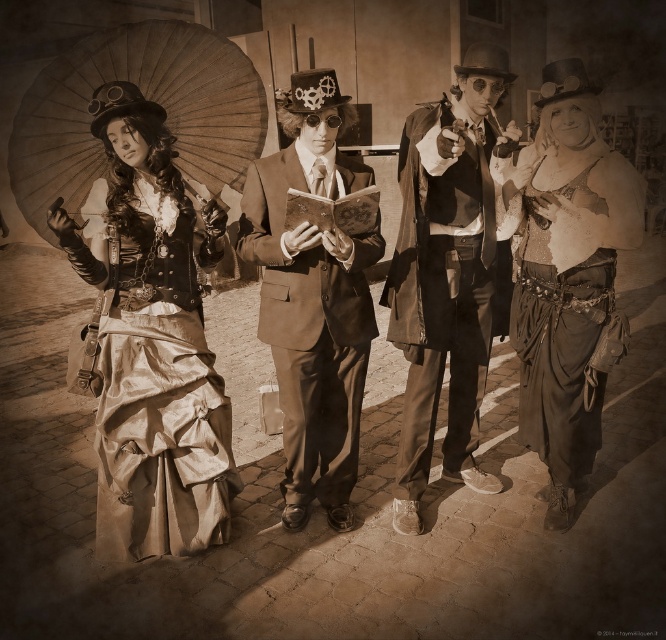
What is located at the coordinates point (151, 340) in the image?

The shiny gold skirt at left is located at point (151, 340).

Based on the photo, in the steampunk scene, there are two central figures wearing a matte brown coat at center and a matte brown suit at center. Which of these two items has a greater width?

The matte brown suit at center has a greater width than the matte brown coat at center.

You are a fashion designer analyzing the steampunk ensemble in the image. Which of the two items, the shiny silver corset at center or the matte brown coat at center, is positioned lower on the person?

The shiny silver corset at center is located below the matte brown coat at center, so it is positioned lower on the person.